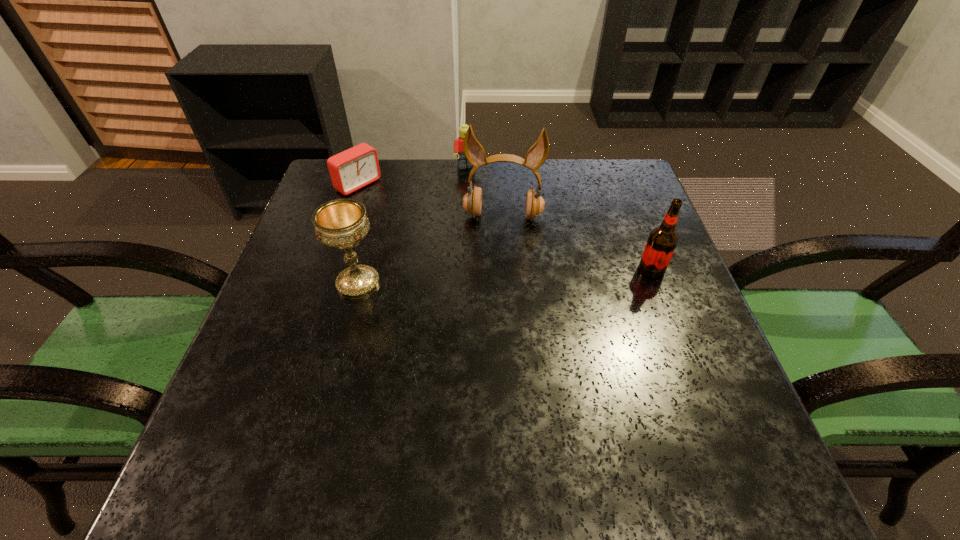
The image size is (960, 540). In order to click on blank space at the far left corner of the desktop in this screenshot , I will do [x=323, y=182].

Where is `free region at the near left corner`? free region at the near left corner is located at coordinates (251, 418).

The width and height of the screenshot is (960, 540). I want to click on vacant point located between the second farthest object and the root beer, so click(x=505, y=227).

In order to click on vacant space in between the root beer and the chalice in this screenshot , I will do `click(505, 276)`.

Locate an element on the screen. free space between the rightmost object and the chalice is located at coordinates (505, 276).

You are a GUI agent. You are given a task and a screenshot of the screen. Output one action in this format:
    pyautogui.click(x=<x>, y=<y>)
    Task: Click on the vacant space that is in between the Lego and the third farthest object
    This screenshot has height=540, width=960.
    Given the screenshot: What is the action you would take?
    pyautogui.click(x=485, y=192)

Where is `empty space that is in between the root beer and the Lego`? empty space that is in between the root beer and the Lego is located at coordinates (560, 219).

Locate an element on the screen. This screenshot has height=540, width=960. unoccupied area between the tallest object and the chalice is located at coordinates point(430,249).

You are a GUI agent. You are given a task and a screenshot of the screen. Output one action in this format:
    pyautogui.click(x=<x>, y=<y>)
    Task: Click on the vacant space that's between the Lego and the chalice
    
    Given the screenshot: What is the action you would take?
    pyautogui.click(x=413, y=225)

This screenshot has height=540, width=960. I want to click on vacant region between the farthest object and the rightmost object, so click(560, 219).